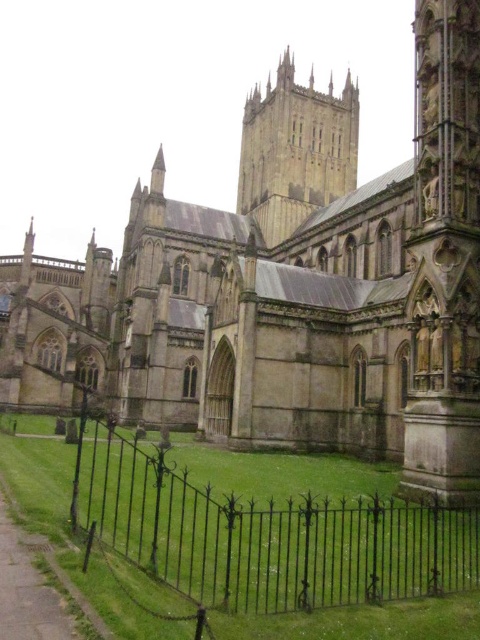
Looking at this image, is black wrought iron fence at lower center closer to the viewer compared to stone tower at center?

Yes, it is.

Is point (420, 516) behind point (254, 189)?

No, (420, 516) is in front of (254, 189).

In order to click on black wrought iron fence at lower center in this screenshot , I will do `click(265, 536)`.